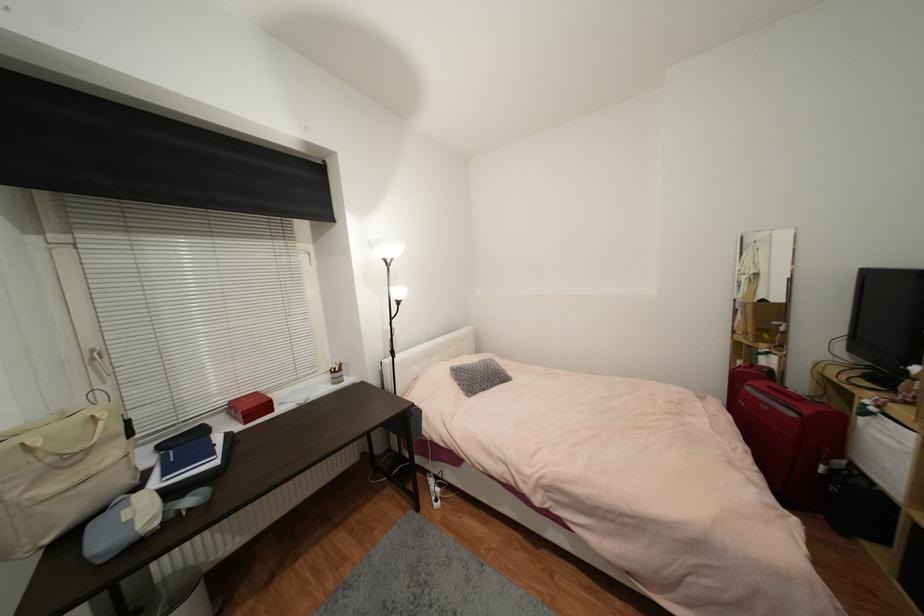
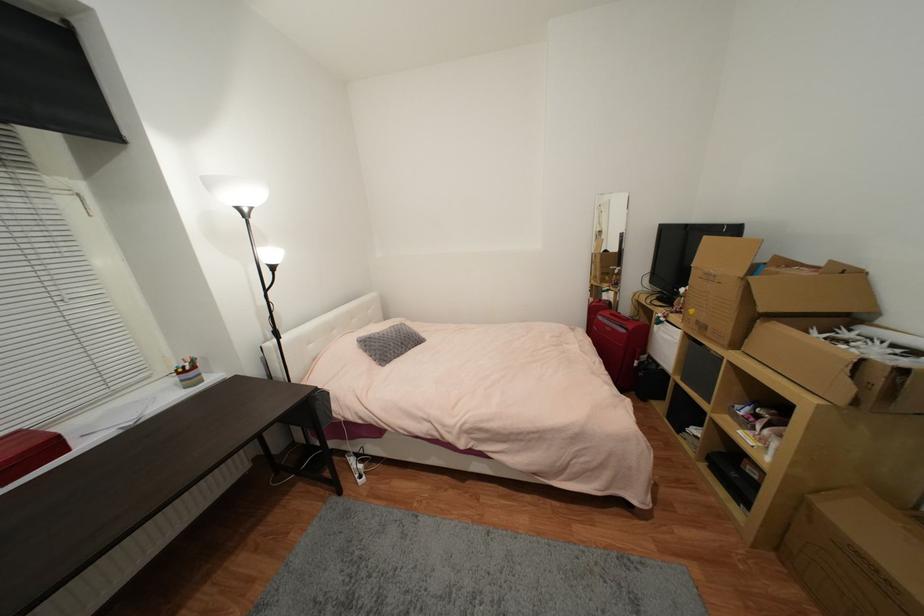
Where in the second image is the point corresponding to point (336, 374) from the first image?

(185, 374)